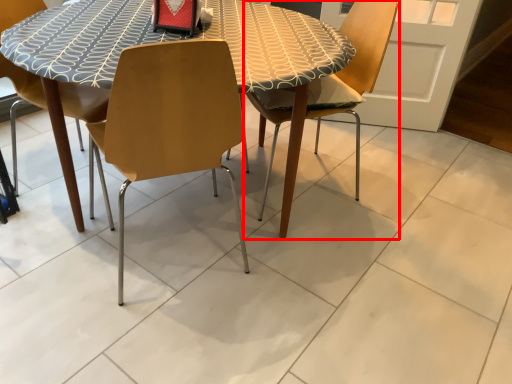
Question: Where is chair (annotated by the red box) located in relation to chair in the image?

Choices:
 (A) right
 (B) left

Answer: (A)